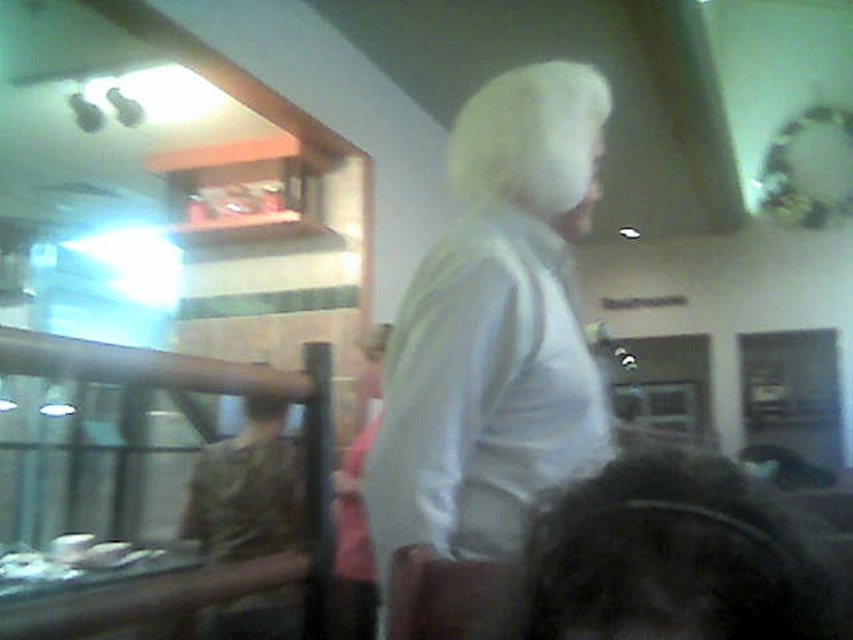
Question: Does white matte hair at upper center appear over camouflage fabric shirt at left?

Choices:
 (A) yes
 (B) no

Answer: (A)

Question: Which of these objects is positioned farthest from the dark curly hair at lower right?

Choices:
 (A) white matte hair at upper center
 (B) camouflage fabric shirt at left
 (C) white matte jacket at center

Answer: (B)

Question: Based on their relative distances, which object is nearer to the white matte hair at upper center?

Choices:
 (A) camouflage fabric shirt at left
 (B) white matte jacket at center
 (C) dark curly hair at lower right

Answer: (B)

Question: Which of these objects is positioned closest to the camouflage fabric shirt at left?

Choices:
 (A) dark curly hair at lower right
 (B) white matte hair at upper center
 (C) white matte jacket at center

Answer: (C)

Question: Can you confirm if dark curly hair at lower right is smaller than camouflage fabric shirt at left?

Choices:
 (A) yes
 (B) no

Answer: (A)

Question: Does dark curly hair at lower right come behind camouflage fabric shirt at left?

Choices:
 (A) yes
 (B) no

Answer: (B)